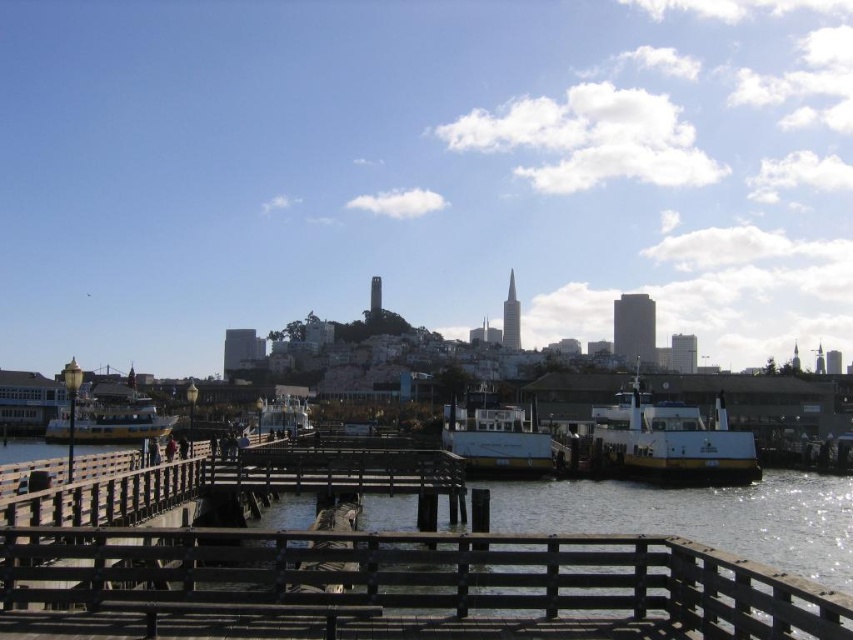
You are standing on the wooden pier and want to board the nearest ferry boat. Which boat should you choose between the yellow matte boat at right and the white matte boat at center?

The yellow matte boat at right is closer to you since it is further to the viewer than the white matte boat at center, so you should choose the yellow matte boat at right.

You are standing on the wooden pier and see two points marked on the water surface. Which point is closer to you, point [108,433] or point [263,397]?

Point [108,433] is closer to the viewer than point [263,397].

You are standing on the wooden pier and want to reach a specific point marked at coordinates point [624,444]. If you can walk 100 feet per minute, how long will it take you to reach that point?

The distance of point [624,444] from viewer is 246.11 feet. At a walking speed of 100 feet per minute, it would take approximately 2.46 minutes, which is roughly 2 minutes and 28 seconds, to reach the point.